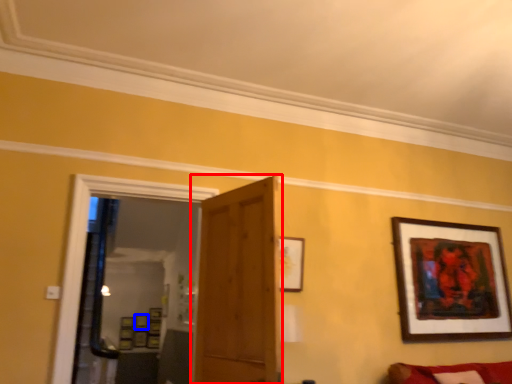
Question: Which object appears closest to the camera in this image, door (highlighted by a red box) or picture frame (highlighted by a blue box)?

Choices:
 (A) door
 (B) picture frame

Answer: (A)